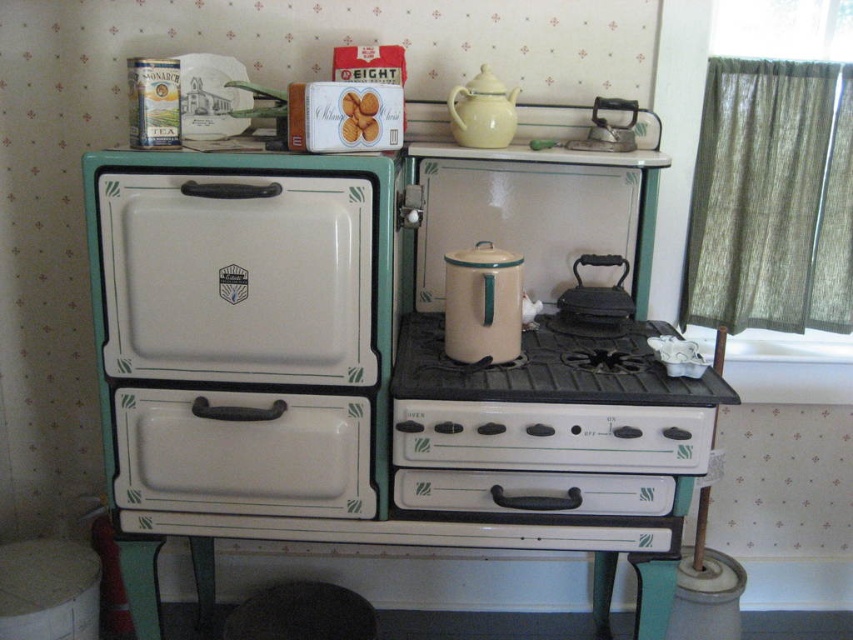
What is the object located at the coordinates point (550, 403) in the vintage kitchen scene?

The object located at point (550, 403) is the white enamel gas stove at center.

You are a chef preparing breakfast and need to reach the ingredients stored in the white enameled cabinet at center. You are currently standing on the black rubber stool at lower center. In which direction should you move to access the cabinet?

The white enameled cabinet at center is to the right of the black rubber stool at lower center, so you should move to your right to access it.